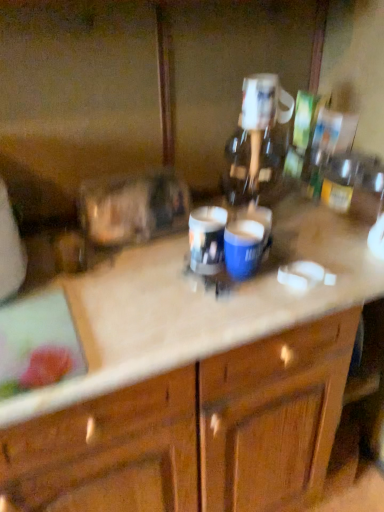
Image resolution: width=384 pixels, height=512 pixels. Identify the location of free space in front of blue glossy mug at center, the 2th beverage from the left. (234, 310).